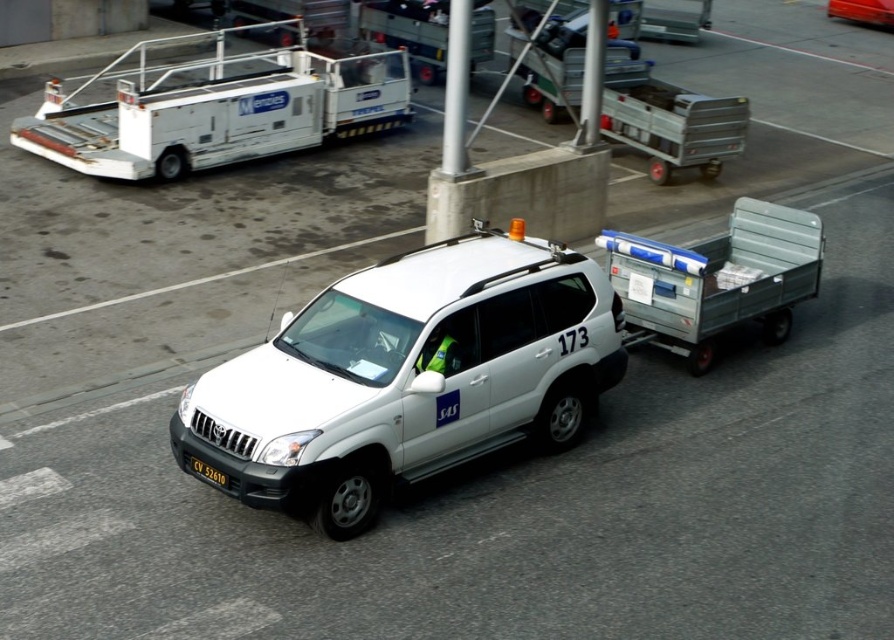
Looking at this image, can you confirm if gray metallic trailer at right is smaller than black plastic license plate at lower center?

No.

This screenshot has height=640, width=894. What do you see at coordinates (717, 280) in the screenshot? I see `gray metallic trailer at right` at bounding box center [717, 280].

This screenshot has width=894, height=640. Find the location of `gray metallic trailer at right`. gray metallic trailer at right is located at coordinates (717, 280).

Does point (738, 305) come closer to viewer compared to point (870, 17)?

That is True.

I want to click on gray metallic trailer at right, so click(x=717, y=280).

The width and height of the screenshot is (894, 640). Find the location of `gray metallic trailer at right`. gray metallic trailer at right is located at coordinates (717, 280).

Does white plastic baggage cart at upper left appear on the left side of black plastic license plate at lower center?

Indeed, white plastic baggage cart at upper left is positioned on the left side of black plastic license plate at lower center.

Between white plastic baggage cart at upper left and black plastic license plate at lower center, which one appears on the left side from the viewer's perspective?

white plastic baggage cart at upper left

Locate an element on the screen. This screenshot has width=894, height=640. white plastic baggage cart at upper left is located at coordinates pos(215,108).

The width and height of the screenshot is (894, 640). Identify the location of white plastic baggage cart at upper left. (215, 108).